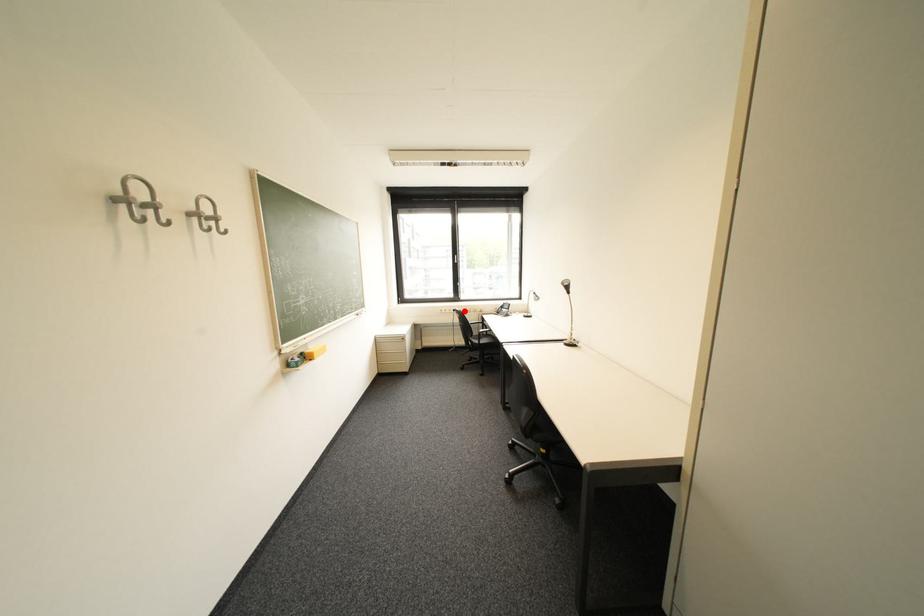
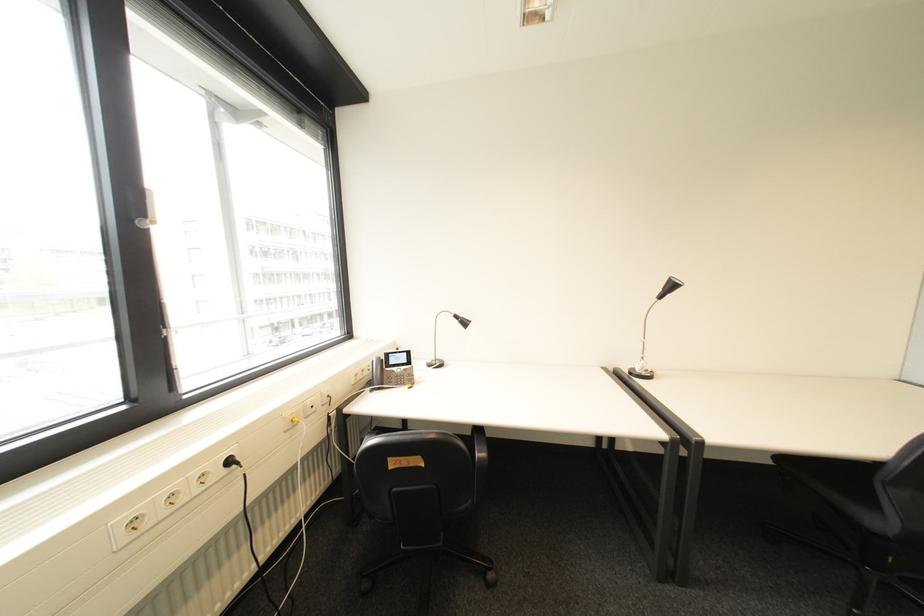
Question: A red point is marked in image1. In image2, is the corresponding 3D point closer to the camera or farther? Reply with the corresponding letter.

Choices:
 (A) The corresponding 3D point is closer.
 (B) The corresponding 3D point is farther.

Answer: (A)